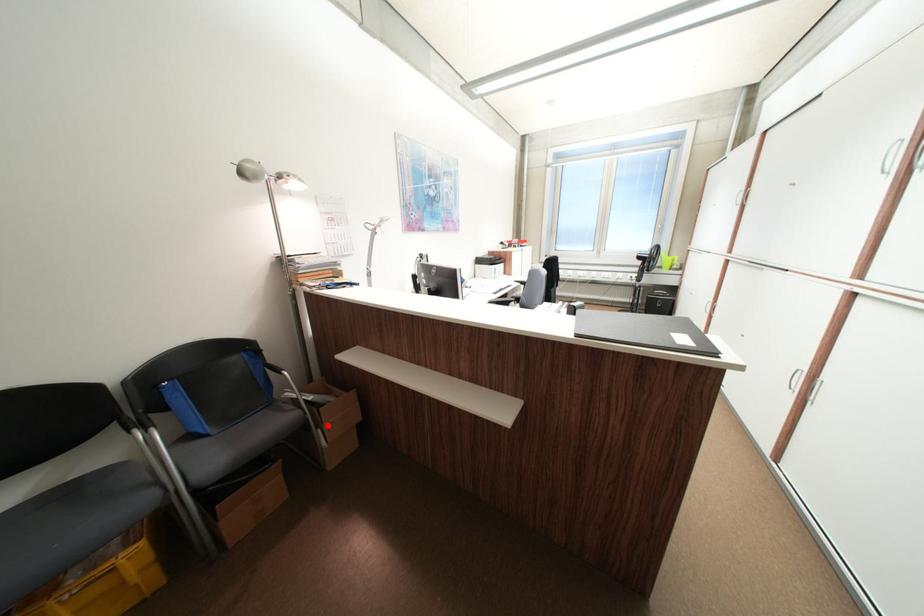
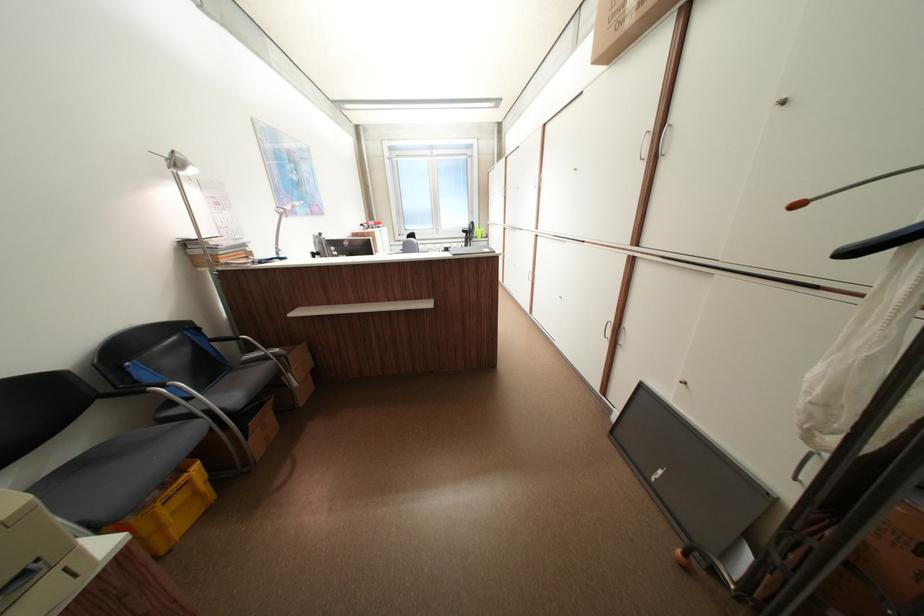
Locate, in the second image, the point that corresponds to the highlighted location in the first image.

(297, 371)